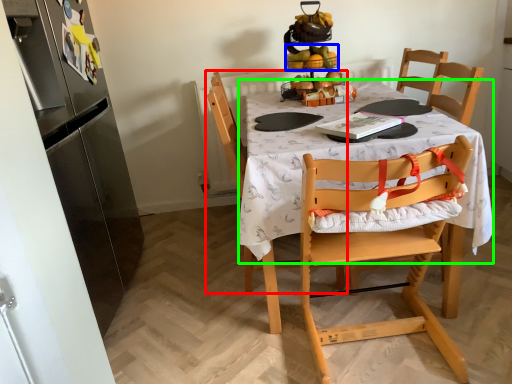
Question: Which object is positioned farthest from chair (highlighted by a red box)? Select from fruit (highlighted by a blue box) and round table (highlighted by a green box).

Choices:
 (A) fruit
 (B) round table

Answer: (A)